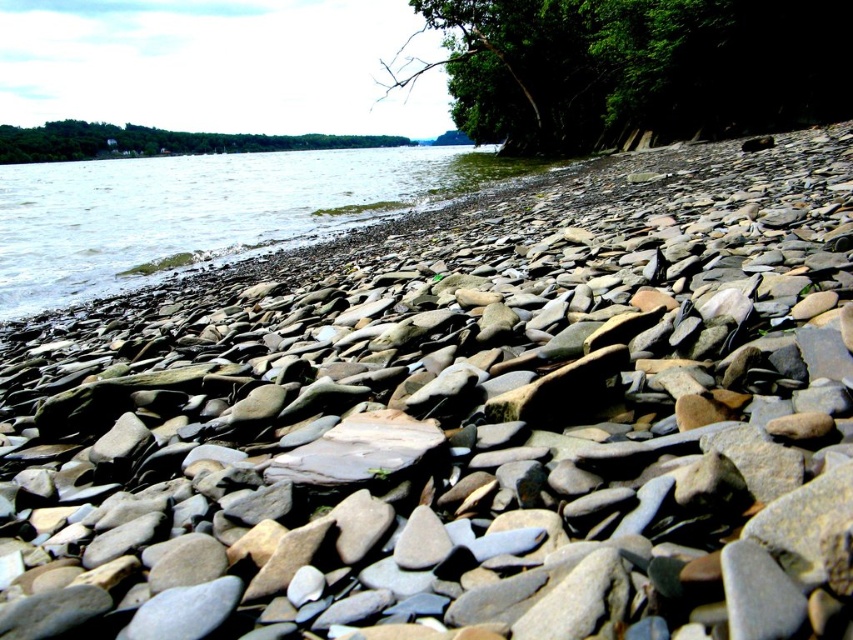
Can you confirm if clear water at lower left is taller than green leafy tree at upper center?

In fact, clear water at lower left may be shorter than green leafy tree at upper center.

Measure the distance between clear water at lower left and camera.

They are 7.42 meters apart.

Locate an element on the screen. clear water at lower left is located at coordinates (207, 211).

Does green leafy tree at upper right have a lesser height compared to green leafy tree at upper center?

Indeed, green leafy tree at upper right has a lesser height compared to green leafy tree at upper center.

Does green leafy tree at upper right have a greater height compared to green leafy tree at upper center?

No.

In order to click on green leafy tree at upper right in this screenshot , I will do `click(637, 68)`.

Is green leafy tree at upper right to the right of clear water at lower left from the viewer's perspective?

Correct, you'll find green leafy tree at upper right to the right of clear water at lower left.

Is green leafy tree at upper right to the left of clear water at lower left from the viewer's perspective?

In fact, green leafy tree at upper right is to the right of clear water at lower left.

Does point (689, 118) lie in front of point (302, 154)?

Yes.

At what (x,y) coordinates should I click in order to perform the action: click on green leafy tree at upper right. Please return your answer as a coordinate pair (x, y). Looking at the image, I should click on pyautogui.click(x=637, y=68).